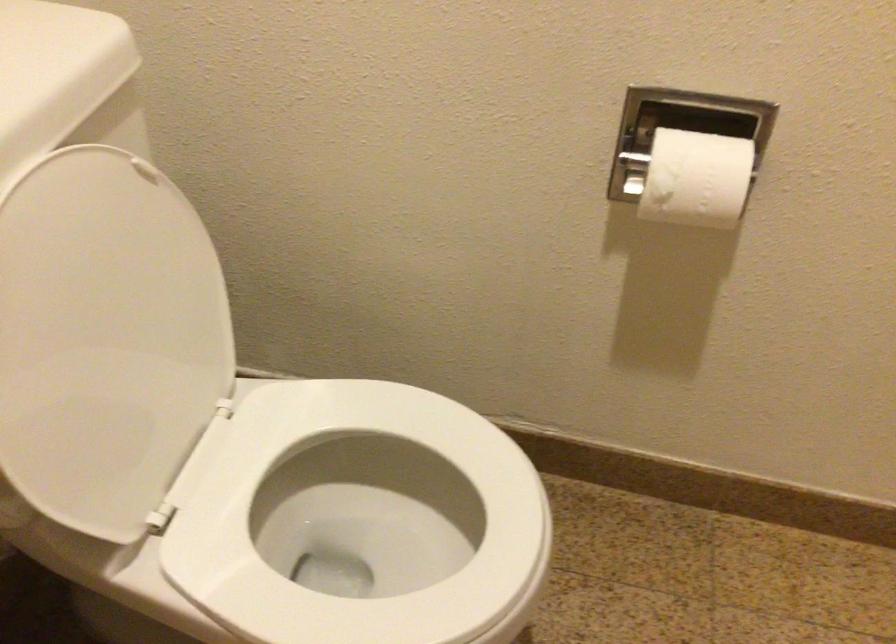
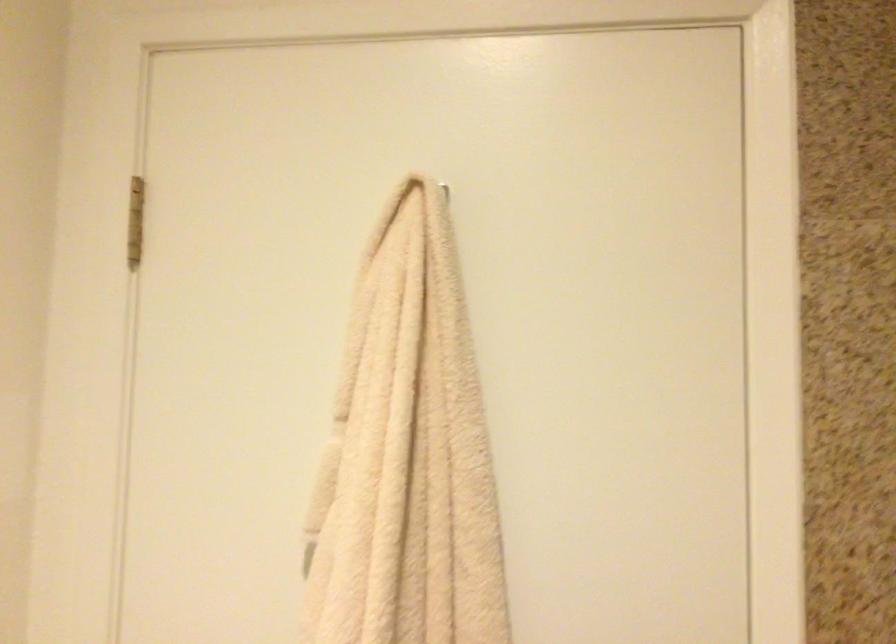
Question: The first image is from the beginning of the video and the second image is from the end. How did the camera likely rotate when shooting the video?

Choices:
 (A) Left
 (B) Right
 (C) Up
 (D) Down

Answer: (B)